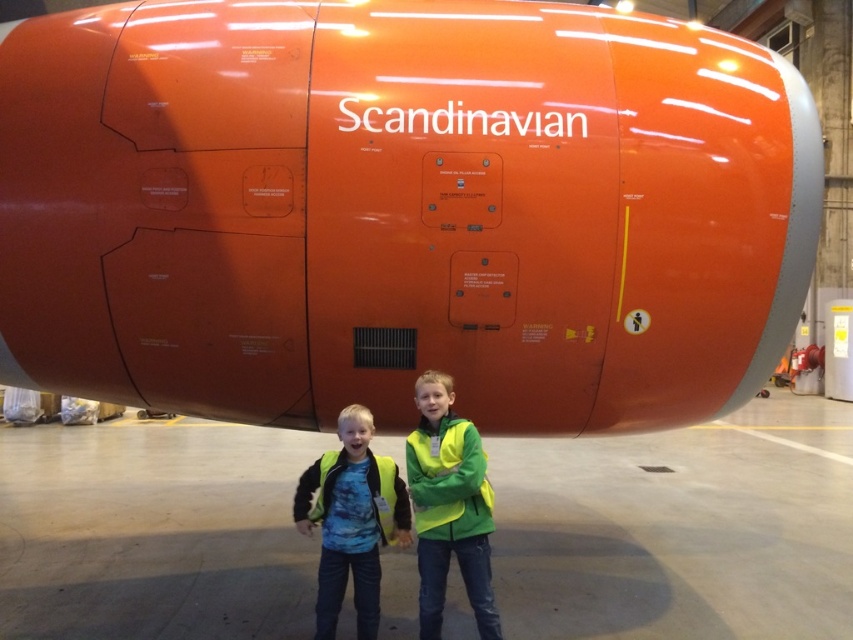
This screenshot has width=853, height=640. What do you see at coordinates (401, 211) in the screenshot? I see `orange matte airplane at center` at bounding box center [401, 211].

Does orange matte airplane at center have a greater width compared to yellow reflective vest at center?

Correct, the width of orange matte airplane at center exceeds that of yellow reflective vest at center.

Who is more distant from viewer, (596, 337) or (328, 458)?

The point (328, 458) is behind.

Find the location of a particular element. The width and height of the screenshot is (853, 640). orange matte airplane at center is located at coordinates (401, 211).

Between orange matte airplane at center and green matte jacket at center, which one has less height?

With less height is green matte jacket at center.

Between orange matte airplane at center and green matte jacket at center, which one has more height?

Standing taller between the two is orange matte airplane at center.

Which is behind, point (74, 113) or point (426, 616)?

The point (426, 616) is behind.

Image resolution: width=853 pixels, height=640 pixels. I want to click on orange matte airplane at center, so click(x=401, y=211).

Between point (491, 593) and point (373, 627), which one is positioned in front?

Point (491, 593) is more forward.

Between yellow reflective vests at center and yellow reflective vest at center, which one is positioned higher?

Positioned higher is yellow reflective vests at center.

Measure the distance between point (x=424, y=404) and camera.

9.36 feet

The width and height of the screenshot is (853, 640). In order to click on yellow reflective vests at center in this screenshot , I will do `click(396, 512)`.